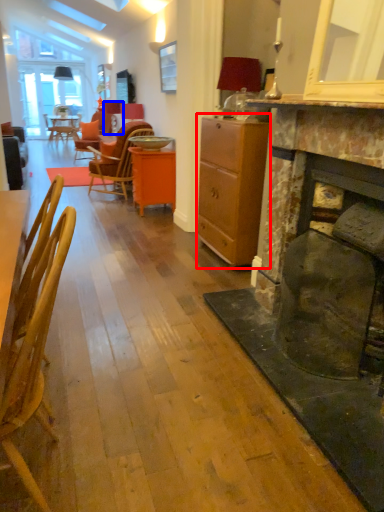
Question: Among these objects, which one is nearest to the camera, cabinetry (highlighted by a red box) or lamp (highlighted by a blue box)?

Choices:
 (A) cabinetry
 (B) lamp

Answer: (A)